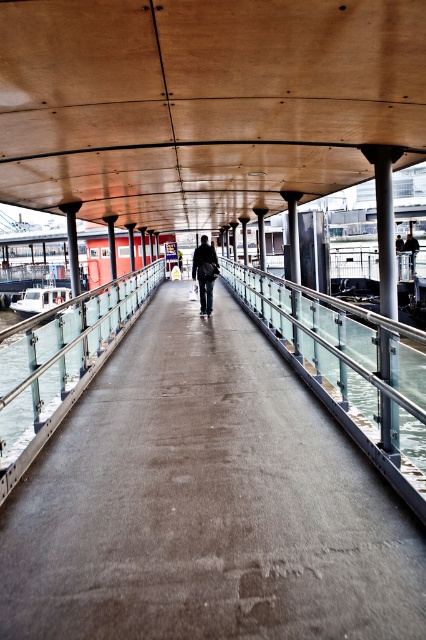
Is concrete walkway at center bigger than dark gray fabric jacket at center?

Yes, concrete walkway at center is bigger than dark gray fabric jacket at center.

Is the position of concrete walkway at center less distant than that of dark gray fabric jacket at center?

Yes, it is in front of dark gray fabric jacket at center.

What are the coordinates of `concrete walkway at center` in the screenshot? It's located at (206, 502).

Can you confirm if concrete walkway at center is bigger than clear glass railing at left?

Actually, concrete walkway at center might be smaller than clear glass railing at left.

This screenshot has width=426, height=640. I want to click on concrete walkway at center, so click(x=206, y=502).

This screenshot has width=426, height=640. Describe the element at coordinates (206, 502) in the screenshot. I see `concrete walkway at center` at that location.

Where is `concrete walkway at center`? The height and width of the screenshot is (640, 426). concrete walkway at center is located at coordinates (206, 502).

Does clear glass railing at center have a lesser width compared to clear glass railing at left?

Incorrect, clear glass railing at center's width is not less than clear glass railing at left's.

Can you confirm if clear glass railing at center is positioned below clear glass railing at left?

Incorrect, clear glass railing at center is not positioned below clear glass railing at left.

Is point (310, 342) positioned before point (54, 317)?

No, it is not.

Find the location of a particular element. clear glass railing at center is located at coordinates (339, 353).